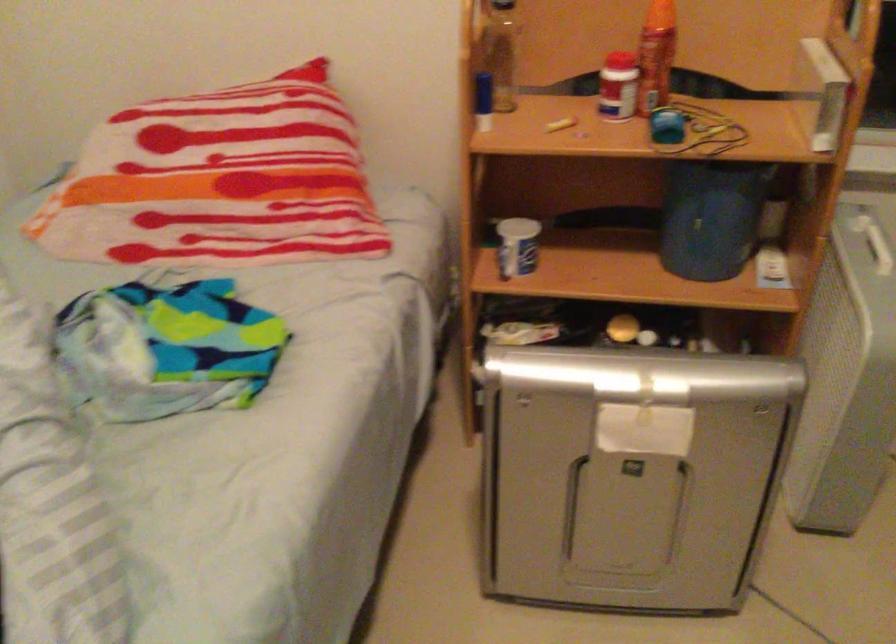
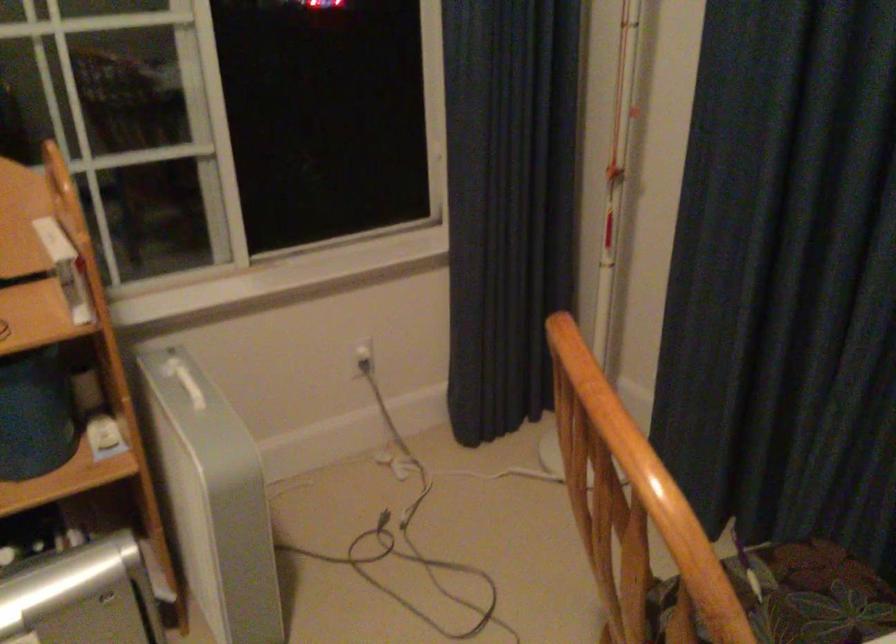
Question: How did the camera likely rotate?

Choices:
 (A) Left
 (B) Right
 (C) Up
 (D) Down

Answer: (B)